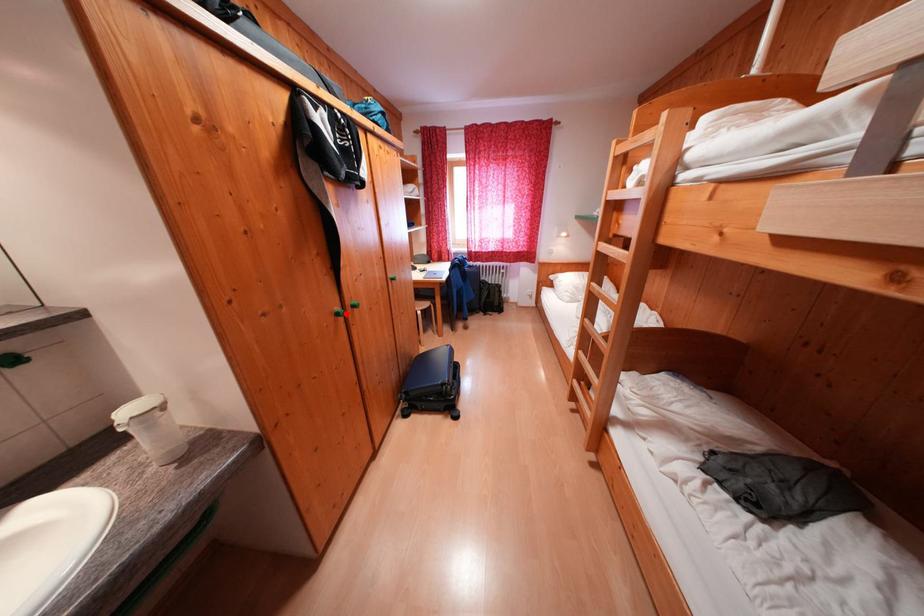
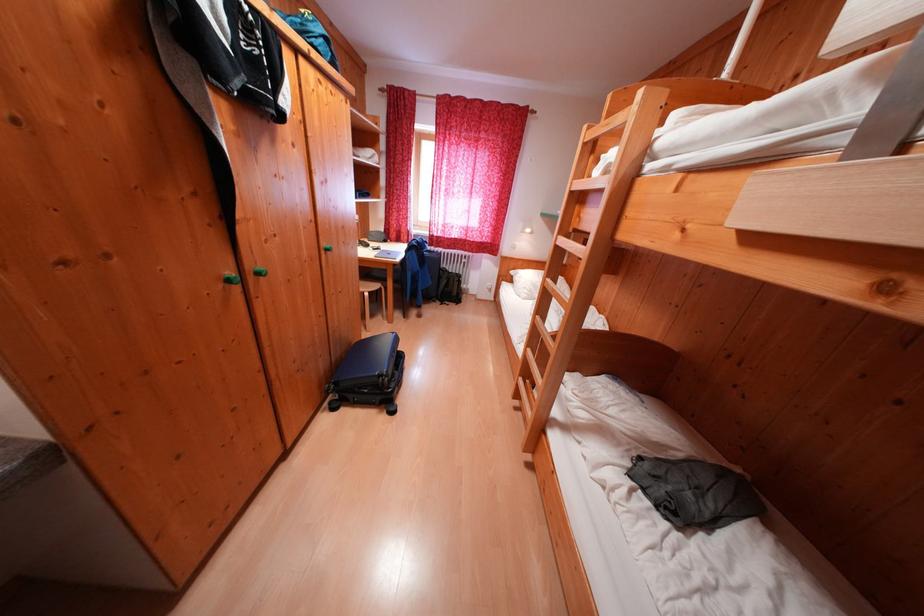
Find the pixel in the second image that matches the highlighted location in the first image.

(238, 278)